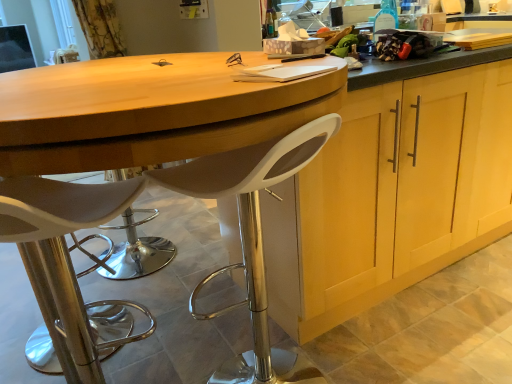
Question: Does white plastic stool at lower left, the 1th chair when ordered from left to right, lie in front of white plastic stool at center, the 2th chair positioned from the left?

Choices:
 (A) yes
 (B) no

Answer: (A)

Question: Is white plastic stool at lower left, the 1th chair when ordered from left to right, aimed at white plastic stool at center, the 2th chair positioned from the left?

Choices:
 (A) no
 (B) yes

Answer: (A)

Question: Can you confirm if white plastic stool at lower left, which ranks as the second chair in right-to-left order, is positioned to the right of white plastic stool at center, the 2th chair positioned from the left?

Choices:
 (A) no
 (B) yes

Answer: (A)

Question: From a real-world perspective, is white plastic stool at lower left, which ranks as the second chair in right-to-left order, positioned over white plastic stool at center, the first chair when ordered from right to left, based on gravity?

Choices:
 (A) no
 (B) yes

Answer: (B)

Question: Is white plastic stool at lower left, the 1th chair when ordered from left to right, positioned far away from white plastic stool at center, the first chair when ordered from right to left?

Choices:
 (A) no
 (B) yes

Answer: (A)

Question: Considering their positions, is matte wood cabinet at center located in front of or behind white plastic stool at center, the first chair when ordered from right to left?

Choices:
 (A) front
 (B) behind

Answer: (B)

Question: Considering the positions of point (425, 145) and point (219, 367), is point (425, 145) closer or farther from the camera than point (219, 367)?

Choices:
 (A) farther
 (B) closer

Answer: (B)

Question: Is matte wood cabinet at center taller or shorter than white plastic stool at center, the first chair when ordered from right to left?

Choices:
 (A) tall
 (B) short

Answer: (A)

Question: Do you think matte wood cabinet at center is within white plastic stool at center, the 2th chair positioned from the left, or outside of it?

Choices:
 (A) inside
 (B) outside

Answer: (B)

Question: Is point (12, 210) positioned closer to the camera than point (303, 203)?

Choices:
 (A) farther
 (B) closer

Answer: (B)

Question: Is white plastic stool at lower left, the 1th chair when ordered from left to right, spatially inside matte wood cabinet at center, or outside of it?

Choices:
 (A) outside
 (B) inside

Answer: (A)

Question: Looking at their shapes, would you say white plastic stool at lower left, the 1th chair when ordered from left to right, is wider or thinner than matte wood cabinet at center?

Choices:
 (A) thin
 (B) wide

Answer: (A)

Question: Considering the positions of white plastic stool at lower left, the 1th chair when ordered from left to right, and matte wood cabinet at center in the image, is white plastic stool at lower left, the 1th chair when ordered from left to right, bigger or smaller than matte wood cabinet at center?

Choices:
 (A) big
 (B) small

Answer: (B)

Question: From their relative heights in the image, would you say white plastic stool at lower left, which ranks as the second chair in right-to-left order, is taller or shorter than white plastic stool at center, the 2th chair positioned from the left?

Choices:
 (A) tall
 (B) short

Answer: (B)

Question: Is white plastic stool at lower left, which ranks as the second chair in right-to-left order, to the left or to the right of white plastic stool at center, the first chair when ordered from right to left, in the image?

Choices:
 (A) left
 (B) right

Answer: (A)